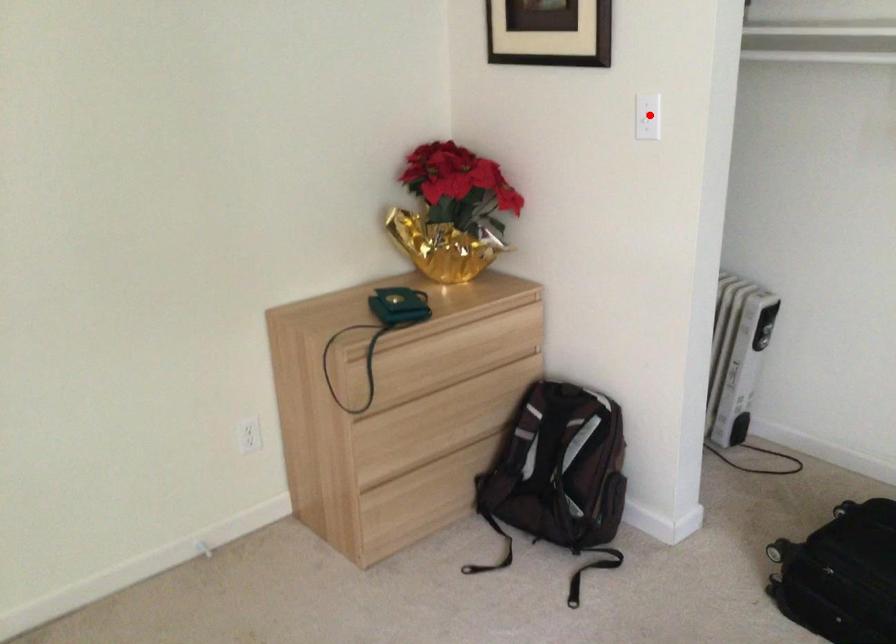
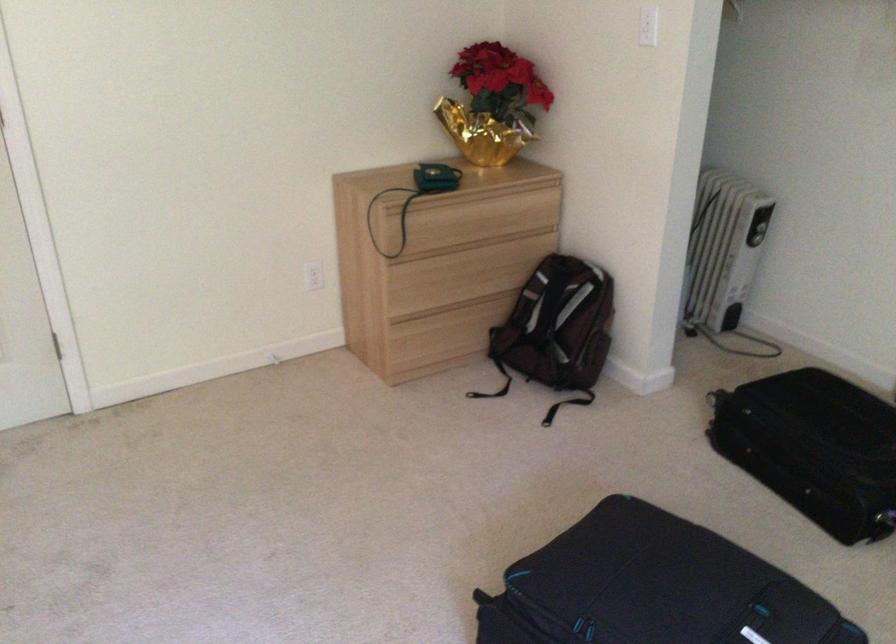
Question: A red point is marked in image1. In image2, is the corresponding 3D point closer to the camera or farther? Reply with the corresponding letter.

Choices:
 (A) The corresponding 3D point is closer.
 (B) The corresponding 3D point is farther.

Answer: (B)